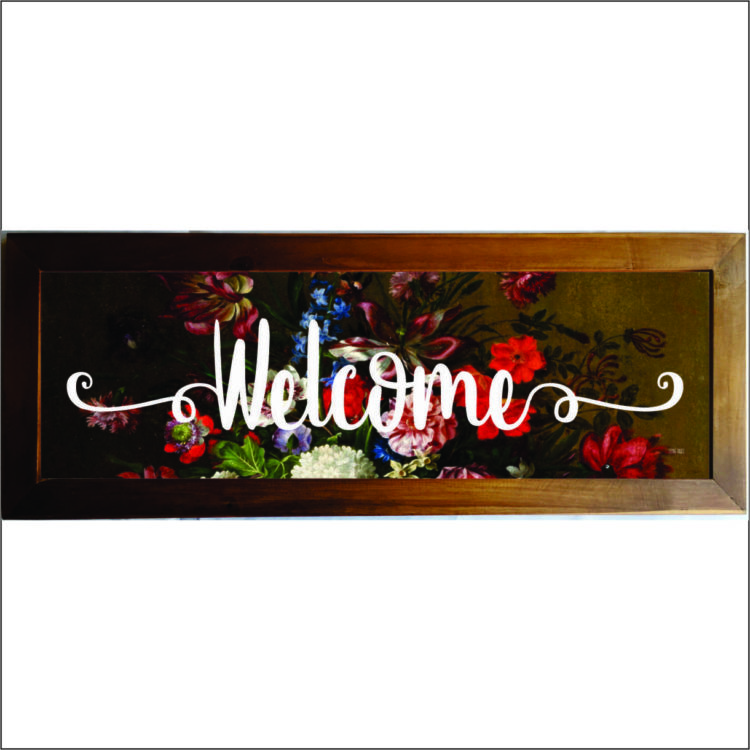
In order to click on lover right miter cut of frame in this screenshot , I will do `click(728, 494)`.